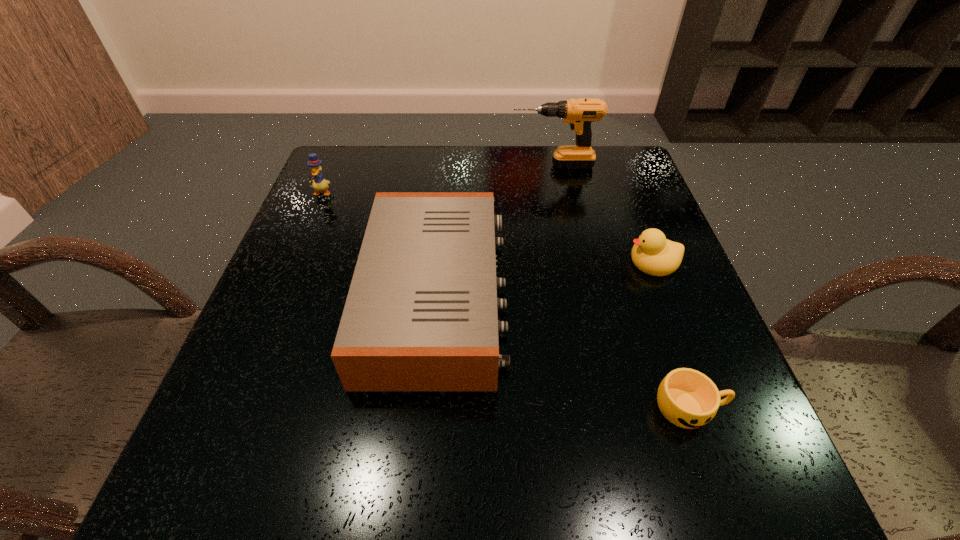
At what (x,y) coordinates should I click in order to perform the action: click on free space at the near left corner. Please return your answer as a coordinate pair (x, y). This screenshot has width=960, height=540. Looking at the image, I should click on (x=286, y=454).

Identify the location of free space at the near right corner of the desktop. (705, 447).

You are a GUI agent. You are given a task and a screenshot of the screen. Output one action in this format:
    pyautogui.click(x=<x>, y=<y>)
    Task: Click on the blank region between the shorter duckling and the cup
    
    Given the screenshot: What is the action you would take?
    pyautogui.click(x=671, y=334)

This screenshot has height=540, width=960. Find the location of `vacant space that's between the shortest object and the second shortest object`. vacant space that's between the shortest object and the second shortest object is located at coordinates (671, 334).

This screenshot has width=960, height=540. In order to click on empty location between the shortest object and the second object from left to right in this screenshot , I will do `click(564, 352)`.

I want to click on blank region between the fourth object from right to left and the right duckling, so click(544, 279).

Where is `free space between the drill and the cup`? free space between the drill and the cup is located at coordinates (621, 286).

Where is `blank region between the right duckling and the cup`? The image size is (960, 540). blank region between the right duckling and the cup is located at coordinates (671, 334).

The image size is (960, 540). I want to click on free space between the shortest object and the fourth object from right to left, so click(564, 352).

This screenshot has width=960, height=540. What are the coordinates of `free space that is in between the taller duckling and the farthest object` in the screenshot? It's located at (437, 179).